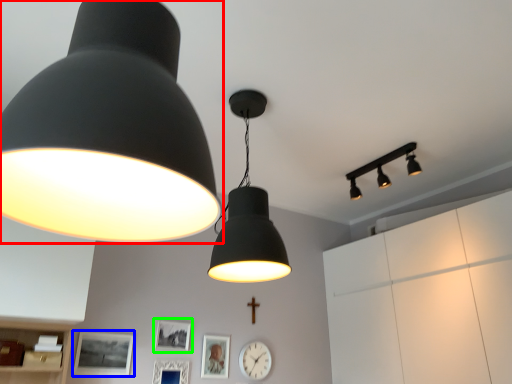
Question: Considering the real-world distances, which object is farthest from lamp (highlighted by a red box)? picture frame (highlighted by a blue box) or picture frame (highlighted by a green box)?

Choices:
 (A) picture frame
 (B) picture frame

Answer: (B)